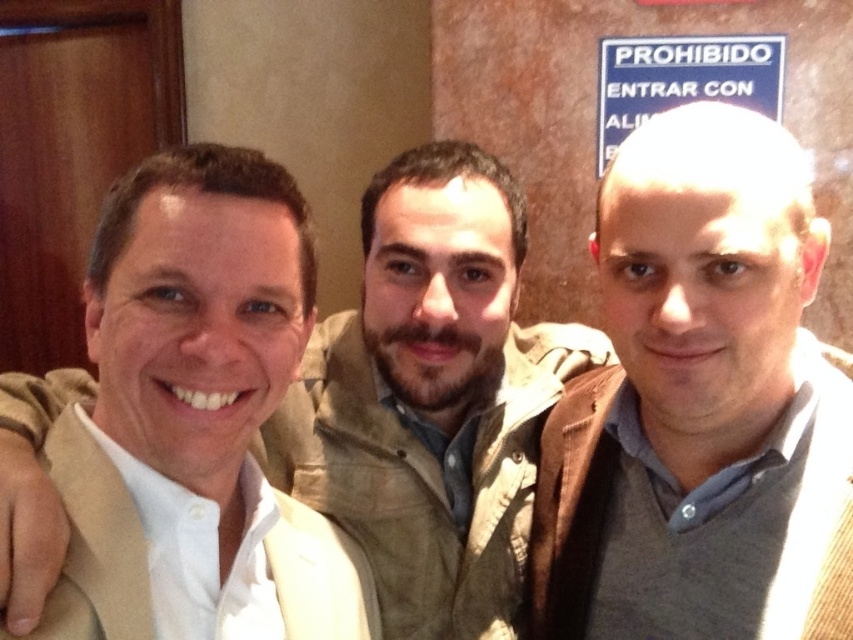
Can you confirm if gray wool sweater at center is positioned above white shirt at center?

No.

Does gray wool sweater at center appear on the left side of white shirt at center?

Incorrect, gray wool sweater at center is not on the left side of white shirt at center.

Who is more distant from viewer, (770, 340) or (386, 188)?

Positioned behind is point (386, 188).

Find the location of `gray wool sweater at center`. gray wool sweater at center is located at coordinates (700, 404).